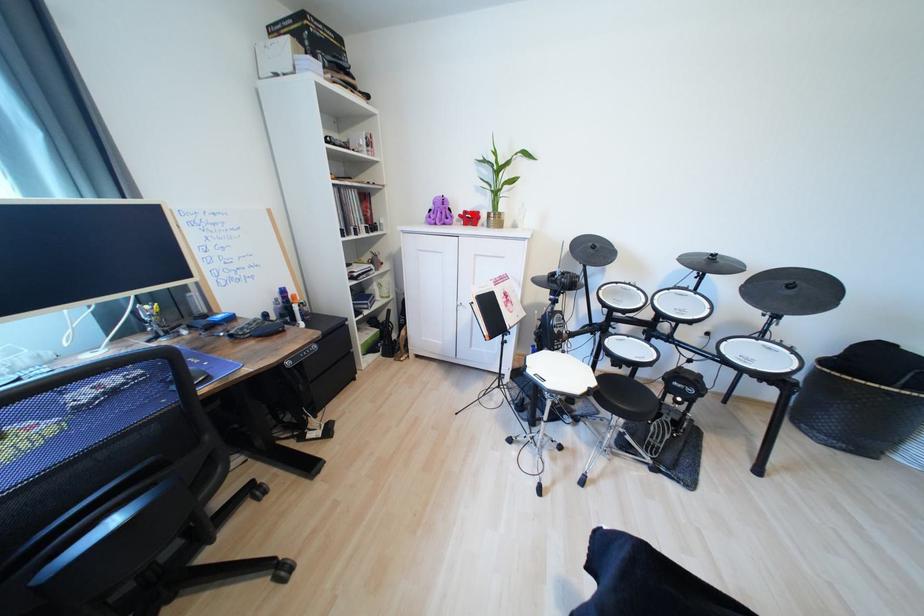
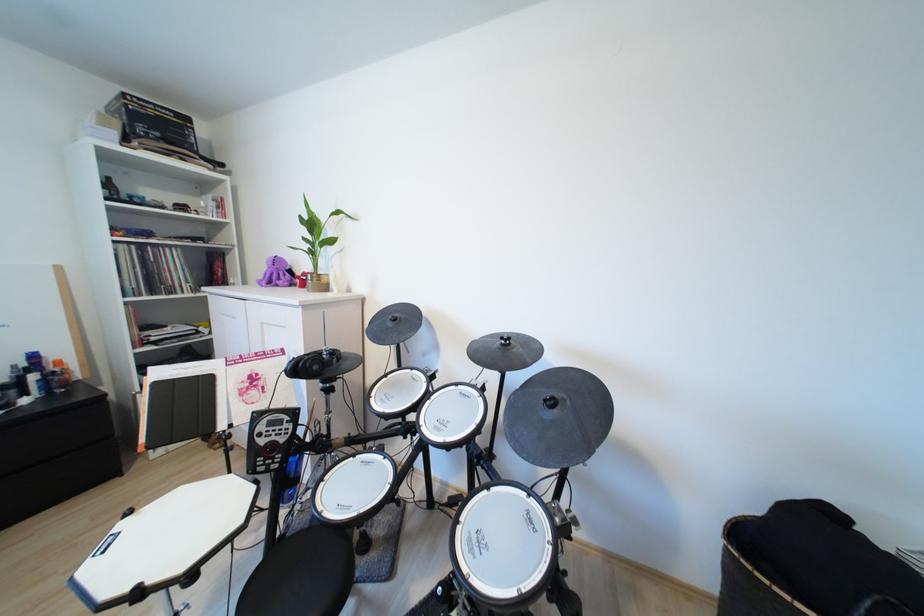
Locate, in the second image, the point that corresponds to the highlighted location in the first image.

(310, 275)